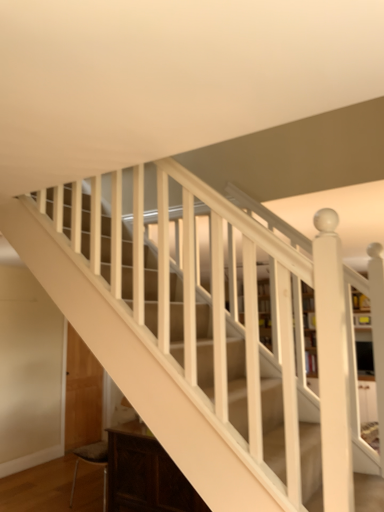
Question: Considering the relative sizes of dark wood cabinet at lower left and wooden bookcase at center in the image provided, is dark wood cabinet at lower left shorter than wooden bookcase at center?

Choices:
 (A) no
 (B) yes

Answer: (B)

Question: Considering the relative sizes of dark wood cabinet at lower left and wooden bookcase at center in the image provided, is dark wood cabinet at lower left thinner than wooden bookcase at center?

Choices:
 (A) no
 (B) yes

Answer: (A)

Question: Considering the relative positions of dark wood cabinet at lower left and wooden bookcase at center in the image provided, is dark wood cabinet at lower left to the left of wooden bookcase at center from the viewer's perspective?

Choices:
 (A) no
 (B) yes

Answer: (B)

Question: Is dark wood cabinet at lower left with wooden bookcase at center?

Choices:
 (A) no
 (B) yes

Answer: (A)

Question: Is dark wood cabinet at lower left positioned beyond the bounds of wooden bookcase at center?

Choices:
 (A) yes
 (B) no

Answer: (A)

Question: Is dark wood cabinet at lower left facing towards wooden bookcase at center?

Choices:
 (A) no
 (B) yes

Answer: (A)

Question: Is wooden bookcase at center surrounding dark wood cabinet at lower left?

Choices:
 (A) yes
 (B) no

Answer: (B)

Question: Is wooden bookcase at center wider than dark wood cabinet at lower left?

Choices:
 (A) no
 (B) yes

Answer: (A)

Question: Considering the relative positions of wooden bookcase at center and dark wood cabinet at lower left in the image provided, is wooden bookcase at center to the right of dark wood cabinet at lower left from the viewer's perspective?

Choices:
 (A) no
 (B) yes

Answer: (B)

Question: Is dark wood cabinet at lower left at the back of wooden bookcase at center?

Choices:
 (A) yes
 (B) no

Answer: (B)

Question: Can you confirm if wooden bookcase at center is taller than dark wood cabinet at lower left?

Choices:
 (A) no
 (B) yes

Answer: (B)

Question: Does wooden bookcase at center lie in front of dark wood cabinet at lower left?

Choices:
 (A) no
 (B) yes

Answer: (A)

Question: From the image's perspective, is dark wood cabinet at lower left positioned above or below wooden bookcase at center?

Choices:
 (A) below
 (B) above

Answer: (A)